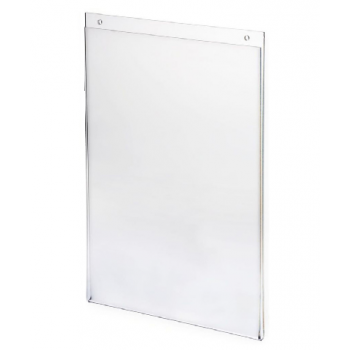
Where is `inside frame edge`? The width and height of the screenshot is (350, 350). inside frame edge is located at coordinates (172, 37), (259, 190), (89, 162).